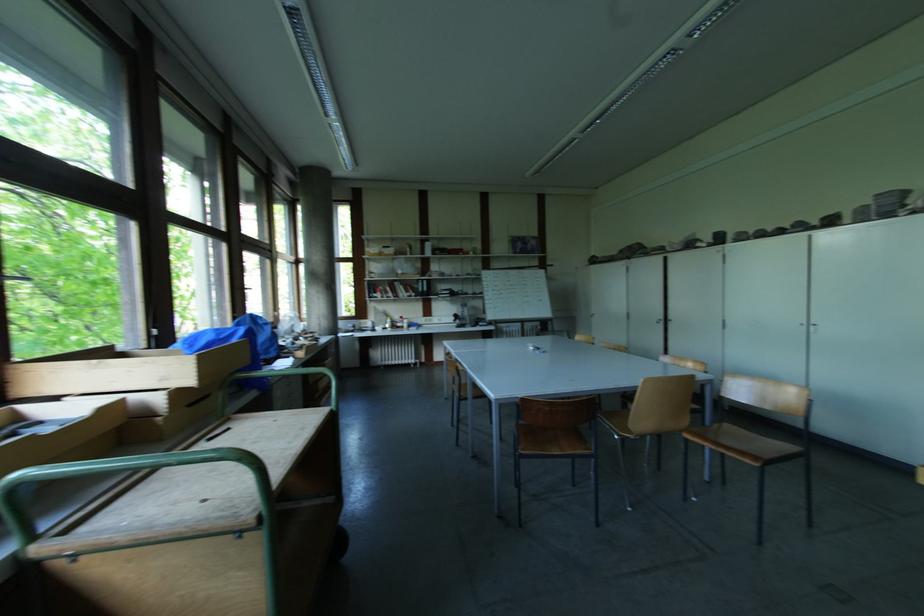
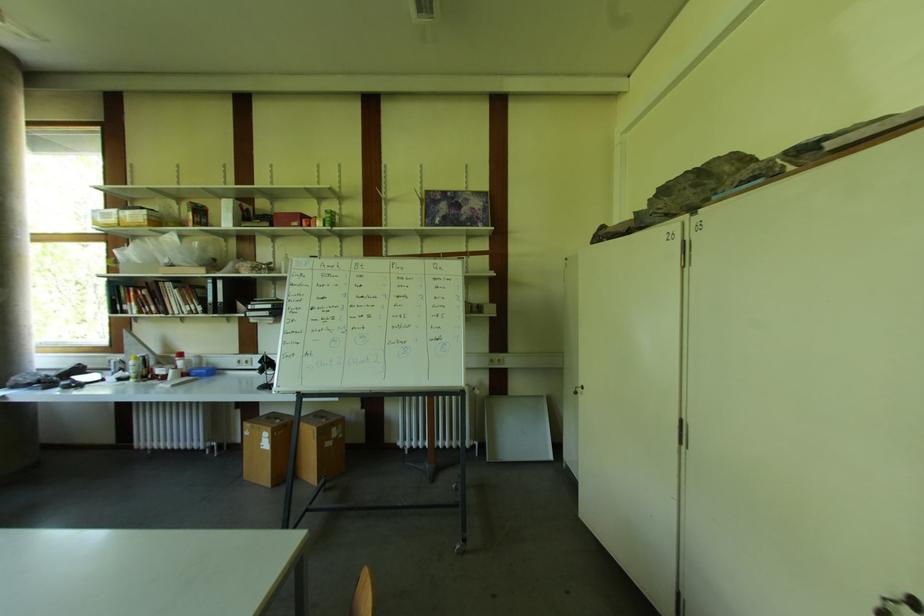
Find the pixel in the second image that matches [594,318] in the first image.

(578, 395)